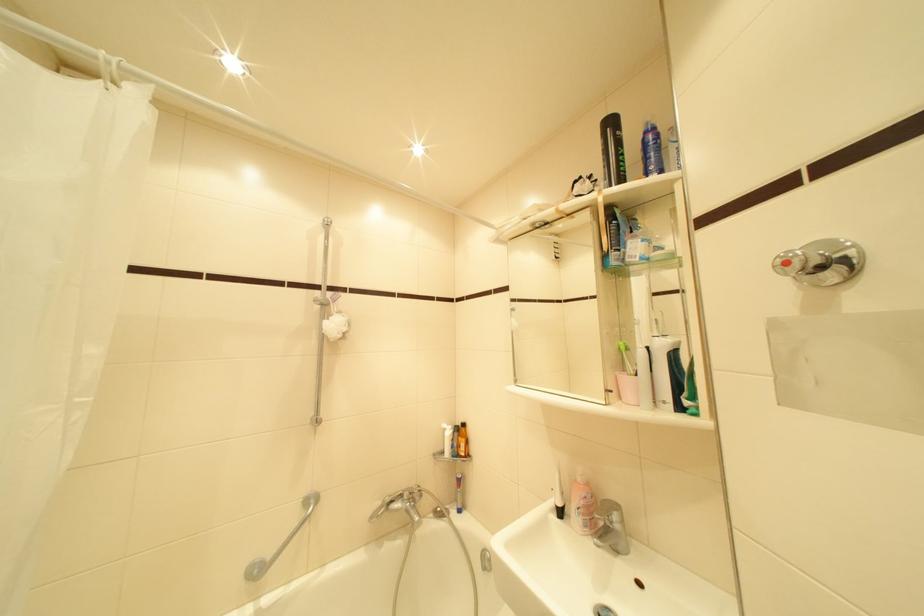
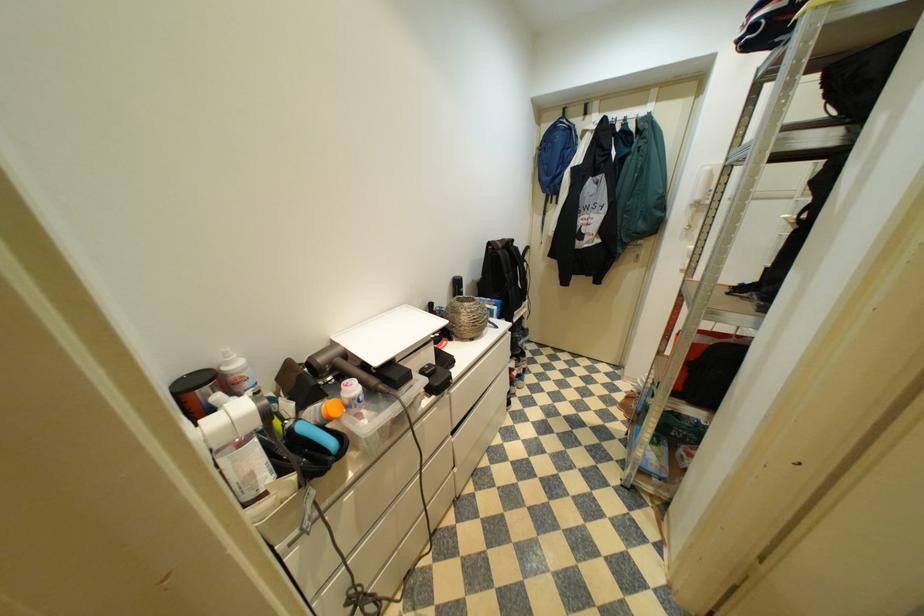
Based on the continuous images, in which direction is the camera rotating?

The camera's rotation is toward right-down.